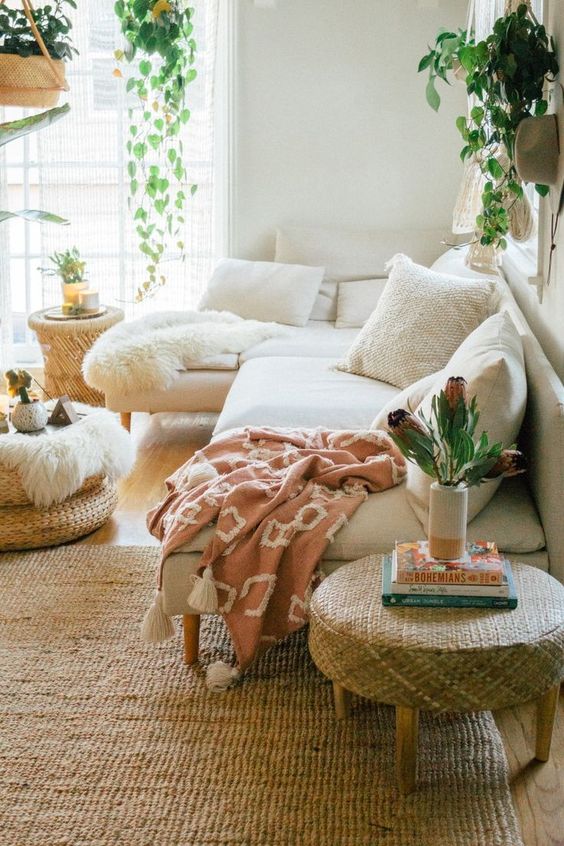
This screenshot has width=564, height=846. I want to click on couch, so click(x=332, y=399), click(x=312, y=371), click(x=309, y=356), click(x=299, y=396).